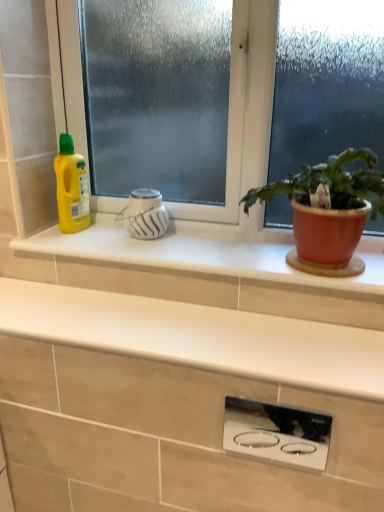
Where is `unoccupied region to the right of white glossy vase at center, which ranks as the 2th appliance in bottom-to-top order`? The image size is (384, 512). unoccupied region to the right of white glossy vase at center, which ranks as the 2th appliance in bottom-to-top order is located at coordinates (200, 244).